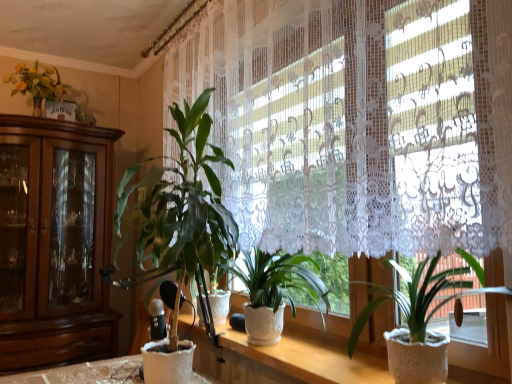
Identify the location of white textured pot at center. (286, 360).

The width and height of the screenshot is (512, 384). What do you see at coordinates (183, 212) in the screenshot? I see `green matte plant at center, the 1th houseplant in the left-to-right sequence` at bounding box center [183, 212].

This screenshot has height=384, width=512. What do you see at coordinates (274, 290) in the screenshot?
I see `white textured pot at center, the second houseplant viewed from the right` at bounding box center [274, 290].

What are the coordinates of `white lace curtain at upper center` in the screenshot? It's located at (358, 121).

Locate an element on the screen. This screenshot has width=512, height=384. white textured pot at center, which appears as the third houseplant when viewed from the left is located at coordinates (416, 298).

From the image's perspective, does green matte plant at center, the 3th houseplant in the right-to-left sequence, appear higher than white textured pot at center, the second houseplant viewed from the right?

Yes, from the image's perspective, green matte plant at center, the 3th houseplant in the right-to-left sequence, is on top of white textured pot at center, the second houseplant viewed from the right.

Is green matte plant at center, the 3th houseplant in the right-to-left sequence, thinner than white textured pot at center, which is counted as the 2th houseplant, starting from the left?

No.

I want to click on the 2nd houseplant below when counting from the green matte plant at center, the 1th houseplant in the left-to-right sequence (from the image's perspective), so click(x=274, y=290).

Considering the positions of objects green matte plant at center, the 3th houseplant in the right-to-left sequence, and white textured pot at center, which is counted as the 2th houseplant, starting from the left, in the image provided, who is more to the left, green matte plant at center, the 3th houseplant in the right-to-left sequence, or white textured pot at center, which is counted as the 2th houseplant, starting from the left,?

green matte plant at center, the 3th houseplant in the right-to-left sequence.

Locate an element on the screen. The width and height of the screenshot is (512, 384). vanity below the white textured pot at center, the second houseplant viewed from the right (from a real-world perspective) is located at coordinates (286, 360).

Is white textured pot at center at the back of white textured pot at center, which is counted as the 2th houseplant, starting from the left?

No, white textured pot at center, which is counted as the 2th houseplant, starting from the left, is not facing away from white textured pot at center.

Is white textured pot at center, the second houseplant viewed from the right, thinner than white textured pot at center?

No, white textured pot at center, the second houseplant viewed from the right, is not thinner than white textured pot at center.

Which is closer, (276,290) or (356,368)?

Point (276,290) is positioned farther from the camera compared to point (356,368).

Looking at this image, which is closer, (458,271) or (280,267)?

The point (458,271) is closer to the camera.

In terms of height, does white textured pot at center, which appears as the third houseplant when viewed from the left, look taller or shorter compared to white textured pot at center, the second houseplant viewed from the right?

Clearly, white textured pot at center, which appears as the third houseplant when viewed from the left, is taller compared to white textured pot at center, the second houseplant viewed from the right.

Which object is positioned more to the right, white textured pot at center, the first houseplant positioned from the right, or white textured pot at center, which is counted as the 2th houseplant, starting from the left?

From the viewer's perspective, white textured pot at center, the first houseplant positioned from the right, appears more on the right side.

Can you tell me how much white textured pot at center, which appears as the third houseplant when viewed from the left, and white textured pot at center, the second houseplant viewed from the right, differ in facing direction?

The angle between the facing direction of white textured pot at center, which appears as the third houseplant when viewed from the left, and the facing direction of white textured pot at center, the second houseplant viewed from the right, is 0.00122 degrees.

Is green matte plant at center, the 1th houseplant in the left-to-right sequence, aimed at white textured pot at center, the first houseplant positioned from the right?

No, green matte plant at center, the 1th houseplant in the left-to-right sequence, is not facing towards white textured pot at center, the first houseplant positioned from the right.

Considering the sizes of objects green matte plant at center, the 3th houseplant in the right-to-left sequence, and white textured pot at center, the first houseplant positioned from the right, in the image provided, who is smaller, green matte plant at center, the 3th houseplant in the right-to-left sequence, or white textured pot at center, the first houseplant positioned from the right,?

Smaller between the two is white textured pot at center, the first houseplant positioned from the right.

Is green matte plant at center, the 3th houseplant in the right-to-left sequence, next to white textured pot at center, the first houseplant positioned from the right, and touching it?

No, green matte plant at center, the 3th houseplant in the right-to-left sequence, is not touching white textured pot at center, the first houseplant positioned from the right.

Does green matte plant at center, the 1th houseplant in the left-to-right sequence, lie behind white textured pot at center, which appears as the third houseplant when viewed from the left?

Yes, it is.

From the image's perspective, is white lace curtain at upper center located above white textured pot at center?

Yes, from the image's perspective, white lace curtain at upper center is on top of white textured pot at center.

How different are the orientations of white lace curtain at upper center and white textured pot at center in degrees?

They differ by 0.812 degrees in their facing directions.

Is white lace curtain at upper center far away from white textured pot at center?

white lace curtain at upper center is near white textured pot at center, not far away.

Which is more to the right, white lace curtain at upper center or white textured pot at center?

white textured pot at center.

Is white textured pot at center, which appears as the third houseplant when viewed from the left, positioned with its back to white textured pot at center?

No, white textured pot at center, which appears as the third houseplant when viewed from the left,'s orientation is not away from white textured pot at center.

Which is behind, point (448, 285) or point (319, 354)?

The point (319, 354) is more distant.

Is white textured pot at center, the first houseplant positioned from the right, at the left side of white textured pot at center?

In fact, white textured pot at center, the first houseplant positioned from the right, is to the right of white textured pot at center.

Considering the positions of points (294, 259) and (184, 124), is point (294, 259) farther from camera compared to point (184, 124)?

No, it is in front of (184, 124).

From a real-world perspective, is white textured pot at center, the second houseplant viewed from the right, over green matte plant at center, the 3th houseplant in the right-to-left sequence?

Actually, white textured pot at center, the second houseplant viewed from the right, is physically below green matte plant at center, the 3th houseplant in the right-to-left sequence, in the real world.

From the image's perspective, which one is positioned higher, white textured pot at center, which is counted as the 2th houseplant, starting from the left, or green matte plant at center, the 3th houseplant in the right-to-left sequence?

green matte plant at center, the 3th houseplant in the right-to-left sequence, is shown above in the image.

Where is `the 2nd houseplant below the green matte plant at center, the 3th houseplant in the right-to-left sequence (from the image's perspective)`? the 2nd houseplant below the green matte plant at center, the 3th houseplant in the right-to-left sequence (from the image's perspective) is located at coordinates (274, 290).

Where is `the 1st houseplant directly above the white textured pot at center (from a real-world perspective)`? The height and width of the screenshot is (384, 512). the 1st houseplant directly above the white textured pot at center (from a real-world perspective) is located at coordinates (274, 290).

Looking at the image, which one is located further to white textured pot at center, which appears as the third houseplant when viewed from the left, green matte plant at center, the 3th houseplant in the right-to-left sequence, or white textured pot at center, which is counted as the 2th houseplant, starting from the left?

green matte plant at center, the 3th houseplant in the right-to-left sequence.

Looking at this image, considering their positions, is green matte plant at center, the 1th houseplant in the left-to-right sequence, positioned closer to white textured pot at center, which is counted as the 2th houseplant, starting from the left, than white textured pot at center?

white textured pot at center is closer to white textured pot at center, which is counted as the 2th houseplant, starting from the left.

Looking at the image, which one is located closer to white lace curtain at upper center, green matte plant at center, the 3th houseplant in the right-to-left sequence, or white textured pot at center, which is counted as the 2th houseplant, starting from the left?

Among the two, green matte plant at center, the 3th houseplant in the right-to-left sequence, is located nearer to white lace curtain at upper center.

Considering their positions, is white textured pot at center, the first houseplant positioned from the right, positioned further to green matte plant at center, the 1th houseplant in the left-to-right sequence, than white lace curtain at upper center?

white textured pot at center, the first houseplant positioned from the right, is positioned further to the anchor green matte plant at center, the 1th houseplant in the left-to-right sequence.

When comparing their distances from white textured pot at center, which is counted as the 2th houseplant, starting from the left, does green matte plant at center, the 3th houseplant in the right-to-left sequence, or white textured pot at center, which appears as the third houseplant when viewed from the left, seem further?

white textured pot at center, which appears as the third houseplant when viewed from the left, is further to white textured pot at center, which is counted as the 2th houseplant, starting from the left.

Looking at this image, estimate the real-world distances between objects in this image. Which object is further from white textured pot at center, white textured pot at center, which is counted as the 2th houseplant, starting from the left, or white textured pot at center, which appears as the third houseplant when viewed from the left?

white textured pot at center, which appears as the third houseplant when viewed from the left, lies further to white textured pot at center than the other object.

Looking at the image, which one is located further to white textured pot at center, which appears as the third houseplant when viewed from the left, white lace curtain at upper center or white textured pot at center, which is counted as the 2th houseplant, starting from the left?

white lace curtain at upper center is further to white textured pot at center, which appears as the third houseplant when viewed from the left.

Considering their positions, is white textured pot at center, the second houseplant viewed from the right, positioned closer to white lace curtain at upper center than green matte plant at center, the 3th houseplant in the right-to-left sequence?

green matte plant at center, the 3th houseplant in the right-to-left sequence, is closer to white lace curtain at upper center.

Locate an element on the screen. The image size is (512, 384). curtain between green matte plant at center, the 3th houseplant in the right-to-left sequence, and white textured pot at center, which appears as the third houseplant when viewed from the left, from left to right is located at coordinates (358, 121).

At what (x,y) coordinates should I click in order to perform the action: click on vanity located between green matte plant at center, the 3th houseplant in the right-to-left sequence, and white textured pot at center, which appears as the third houseplant when viewed from the left, in the left-right direction. Please return your answer as a coordinate pair (x, y). Image resolution: width=512 pixels, height=384 pixels. Looking at the image, I should click on (286, 360).

At what (x,y) coordinates should I click in order to perform the action: click on houseplant between green matte plant at center, the 1th houseplant in the left-to-right sequence, and white textured pot at center, which appears as the third houseplant when viewed from the left, from left to right. Please return your answer as a coordinate pair (x, y). Image resolution: width=512 pixels, height=384 pixels. Looking at the image, I should click on (274, 290).

This screenshot has height=384, width=512. I want to click on houseplant between white textured pot at center and white textured pot at center, which appears as the third houseplant when viewed from the left, so click(274, 290).